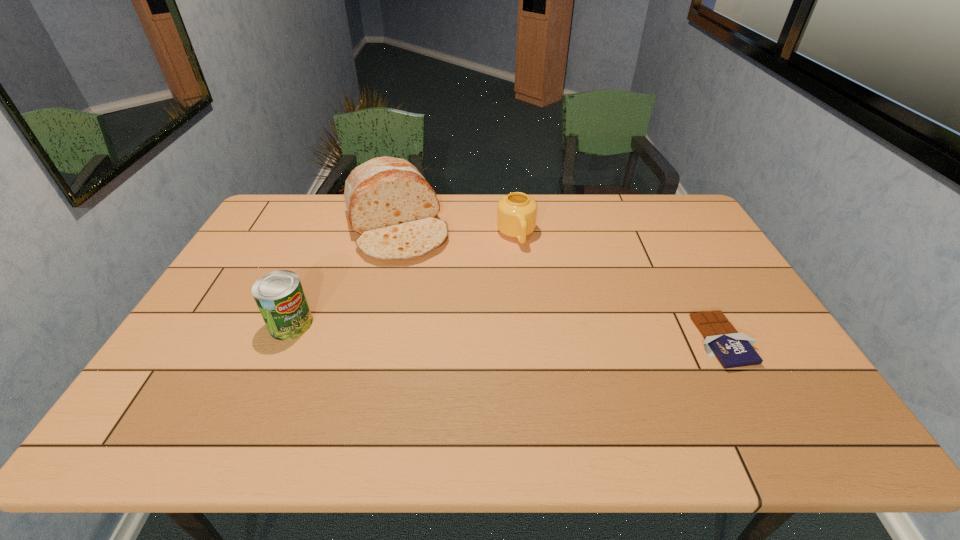
Where is `free space between the can and the mug`? free space between the can and the mug is located at coordinates (404, 280).

The image size is (960, 540). Find the location of `vacant point located between the mug and the chocolate bar`. vacant point located between the mug and the chocolate bar is located at coordinates (620, 288).

You are a GUI agent. You are given a task and a screenshot of the screen. Output one action in this format:
    pyautogui.click(x=<x>, y=<y>)
    Task: Click on the empty location between the can and the mug
    The image size is (960, 540).
    Given the screenshot: What is the action you would take?
    pyautogui.click(x=404, y=280)

Identify the location of empty space between the can and the bread. Image resolution: width=960 pixels, height=540 pixels. (344, 275).

Locate an element on the screen. object that can be found as the third closest to the chocolate bar is located at coordinates (279, 295).

Select which object is the third closest to the can. Please provide its 2D coordinates. Your answer should be formatted as a tuple, i.e. [(x, y)], where the tuple contains the x and y coordinates of a point satisfying the conditions above.

[(733, 349)]

This screenshot has height=540, width=960. I want to click on free space that satisfies the following two spatial constraints: 1. on the back side of the can; 2. on the right side of the mug, so click(x=330, y=235).

At what (x,y) coordinates should I click in order to perform the action: click on vacant space that satisfies the following two spatial constraints: 1. on the back side of the can; 2. on the left side of the bread. Please return your answer as a coordinate pair (x, y). Looking at the image, I should click on (333, 227).